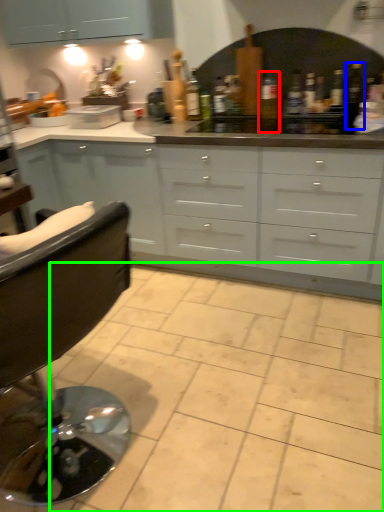
Question: Considering the real-world distances, which object is farthest from bottle (highlighted by a red box)? bottle (highlighted by a blue box) or ceramic tile (highlighted by a green box)?

Choices:
 (A) bottle
 (B) ceramic tile

Answer: (B)